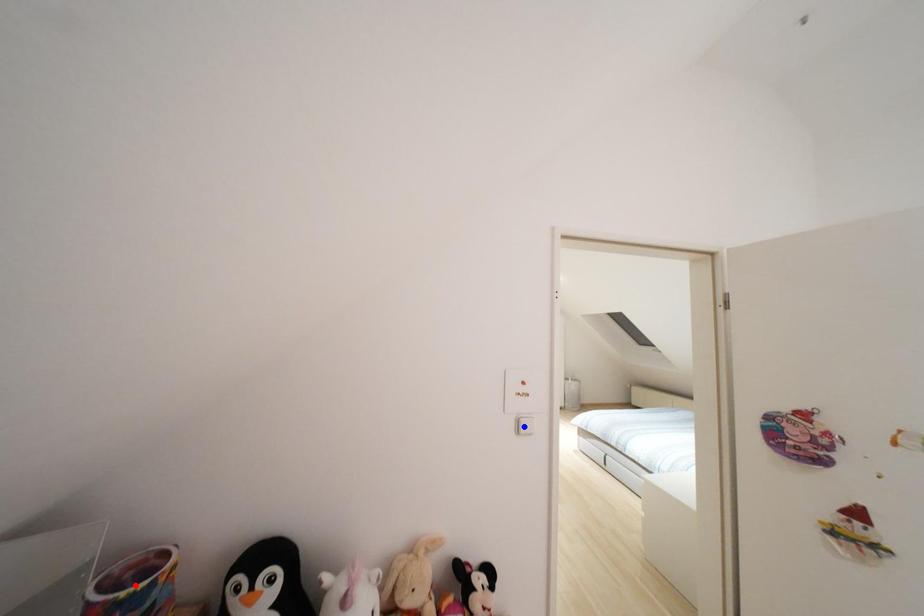
Question: Two points are marked on the image. Which point is closer to the camera?

Choices:
 (A) Blue point is closer.
 (B) Red point is closer.

Answer: (B)